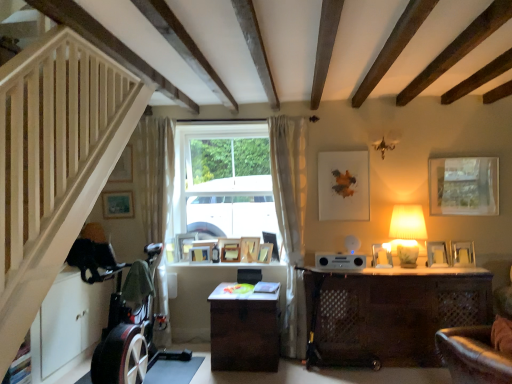
Question: Would you say wooden picture frame at center, placed as the seventh picture frame when sorted from right to left, is to the left or to the right of matte silver picture frame at right, the 3th picture frame in the right-to-left sequence, in the picture?

Choices:
 (A) right
 (B) left

Answer: (B)

Question: Is wooden picture frame at center, arranged as the 4th picture frame when viewed from the left, in front of or behind matte silver picture frame at right, placed as the eighth picture frame when sorted from left to right, in the image?

Choices:
 (A) front
 (B) behind

Answer: (B)

Question: Which is farther from the wooden picture frame at center, arranged as the 4th picture frame when viewed from the left?

Choices:
 (A) wooden stairwell at left
 (B) wooden picture frame at center, which appears as the 7th picture frame when viewed from the left
 (C) matte blue picture frame at lower left, which ranks as the second picture frame in left-to-right order
 (D) brown woven table at center
 (E) wooden photo frame at center, the 6th picture frame viewed from the left

Answer: (A)

Question: Estimate the real-world distances between objects in this image. Which object is farther from the silver metallic picture frame at right, which is the second picture frame in right-to-left order?

Choices:
 (A) white fabric lampshade at right
 (B) white sheer curtain at center, which is counted as the 2th curtain, starting from the left
 (C) wooden picture frame at center, which ranks as the 3th picture frame in left-to-right order
 (D) wooden picture frame at center, placed as the seventh picture frame when sorted from right to left
 (E) matte gold picture frame at upper left, positioned as the first picture frame in left-to-right order

Answer: (E)